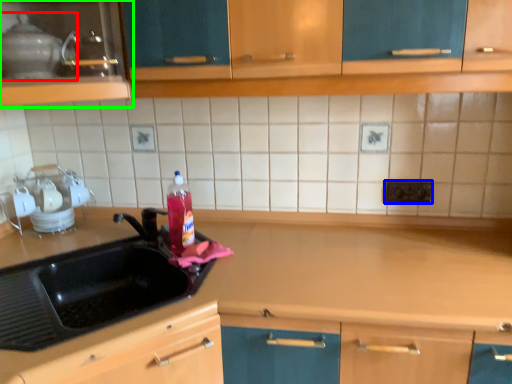
Question: Based on their relative distances, which object is farther from appliance (highlighted by a red box)? Choose from electric outlet (highlighted by a blue box) and cabinetry (highlighted by a green box).

Choices:
 (A) electric outlet
 (B) cabinetry

Answer: (A)